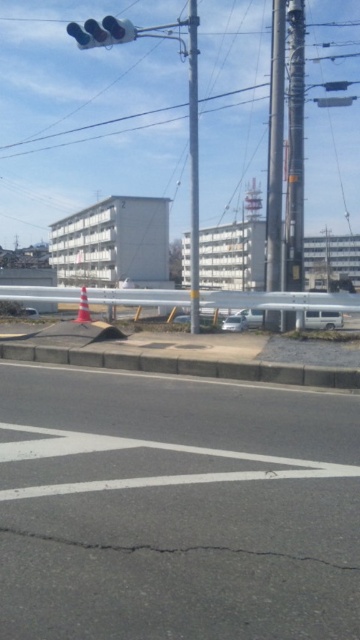
Question: Is smooth metallic pole at center to the left of metallic gray pole at upper right from the viewer's perspective?

Choices:
 (A) yes
 (B) no

Answer: (A)

Question: Which object is farther from the camera taking this photo?

Choices:
 (A) metallic pole at center
 (B) smooth metallic pole at center

Answer: (B)

Question: In this image, where is black asphalt at center located relative to metallic gray pole at upper right?

Choices:
 (A) left
 (B) right

Answer: (A)

Question: Among these objects, which one is nearest to the camera?

Choices:
 (A) metallic pole at center
 (B) black asphalt at center

Answer: (B)

Question: Which of these objects is positioned farthest from the black asphalt at center?

Choices:
 (A) metallic traffic light at upper center
 (B) metallic pole at center

Answer: (B)

Question: Can you confirm if smooth metallic pole at center is bigger than orange reflective cone at center?

Choices:
 (A) yes
 (B) no

Answer: (B)